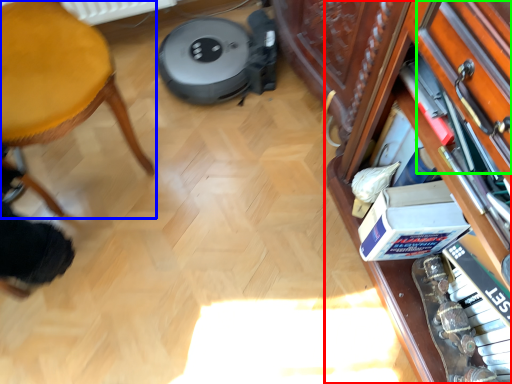
Question: Considering the real-world distances, which object is farthest from shelf (highlighted by a red box)? furniture (highlighted by a blue box) or drawer (highlighted by a green box)?

Choices:
 (A) furniture
 (B) drawer

Answer: (A)